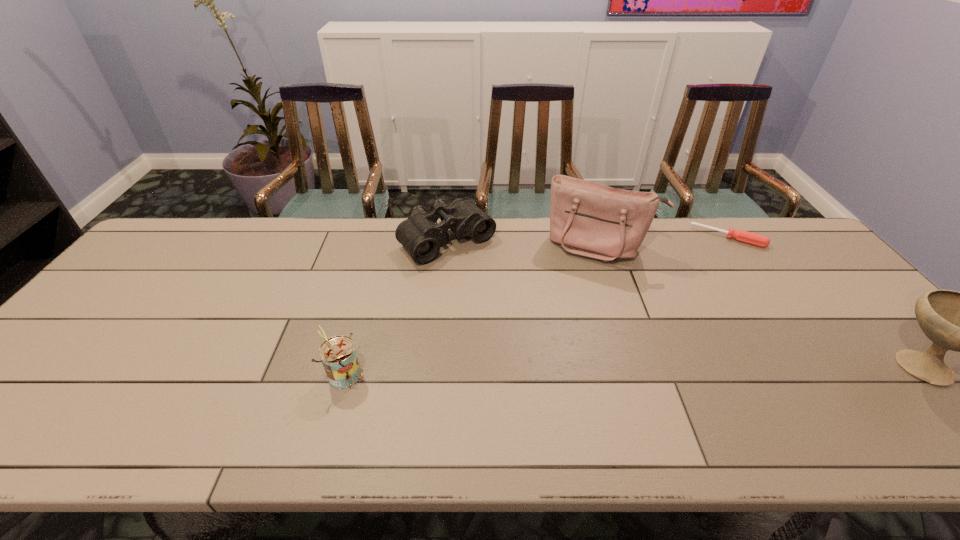
The image size is (960, 540). Identify the location of can. (338, 354).

The width and height of the screenshot is (960, 540). In order to click on the leftmost object in this screenshot , I will do `click(338, 354)`.

Where is `the second object from left to right`? This screenshot has height=540, width=960. the second object from left to right is located at coordinates (420, 234).

In order to click on the second shortest object in this screenshot , I will do `click(420, 234)`.

At what (x,y) coordinates should I click in order to perform the action: click on the shortest object. Please return your answer as a coordinate pair (x, y). Image resolution: width=960 pixels, height=540 pixels. Looking at the image, I should click on (743, 236).

Find the location of a particular element. This screenshot has width=960, height=540. screwdriver is located at coordinates click(743, 236).

Identify the location of the third object from right to left. This screenshot has height=540, width=960. (589, 219).

The height and width of the screenshot is (540, 960). Identify the location of shoulder bag. (589, 219).

Identify the location of free region located 0.140m on the left of the leftmost object. This screenshot has height=540, width=960. (267, 374).

In order to click on free point located at the eyepieces of the second object from left to right in this screenshot , I will do `click(488, 279)`.